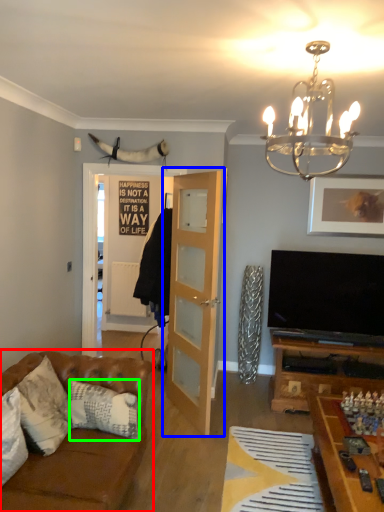
Question: Estimate the real-world distances between objects in this image. Which object is closer to studio couch (highlighted by a red box), door (highlighted by a blue box) or pillow (highlighted by a green box)?

Choices:
 (A) door
 (B) pillow

Answer: (B)